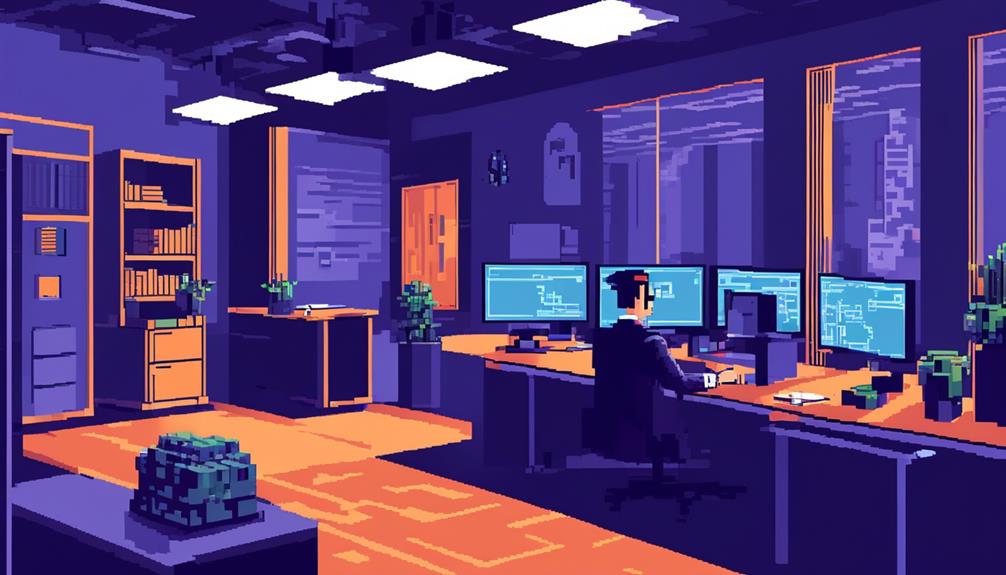
The height and width of the screenshot is (575, 1006). Identify the location of tables. (315, 315), (131, 520).